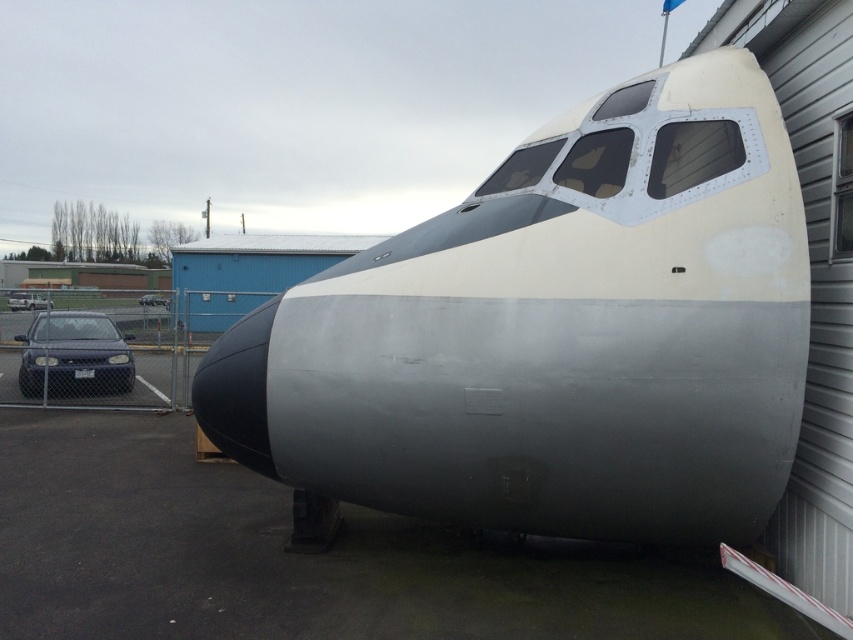
Question: Which object is positioned farthest from the matte blue car at lower left?

Choices:
 (A) matte black car at left
 (B) matte gray airplane at center
 (C) shiny blue sedan at lower left

Answer: (B)

Question: Is matte gray airplane at center positioned in front of shiny blue sedan at lower left?

Choices:
 (A) no
 (B) yes

Answer: (B)

Question: Which is farther from the matte black car at left?

Choices:
 (A) matte gray airplane at center
 (B) shiny blue sedan at lower left

Answer: (A)

Question: Is matte blue car at lower left wider than matte black car at left?

Choices:
 (A) no
 (B) yes

Answer: (B)

Question: Can you confirm if matte gray airplane at center is positioned below matte black car at left?

Choices:
 (A) no
 (B) yes

Answer: (B)

Question: Which of the following is the closest to the observer?

Choices:
 (A) (146, 296)
 (B) (247, 387)
 (C) (12, 300)
 (D) (39, 346)

Answer: (B)